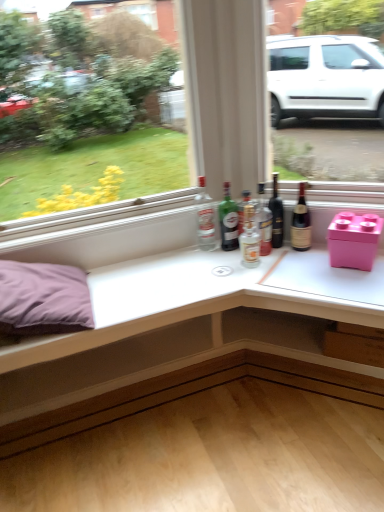
At what (x,y) coordinates should I click in order to perform the action: click on free area below white glossy table at upper center (from a real-world perspective). Please return your answer as a coordinate pair (x, y). The image size is (384, 512). Looking at the image, I should click on (220, 424).